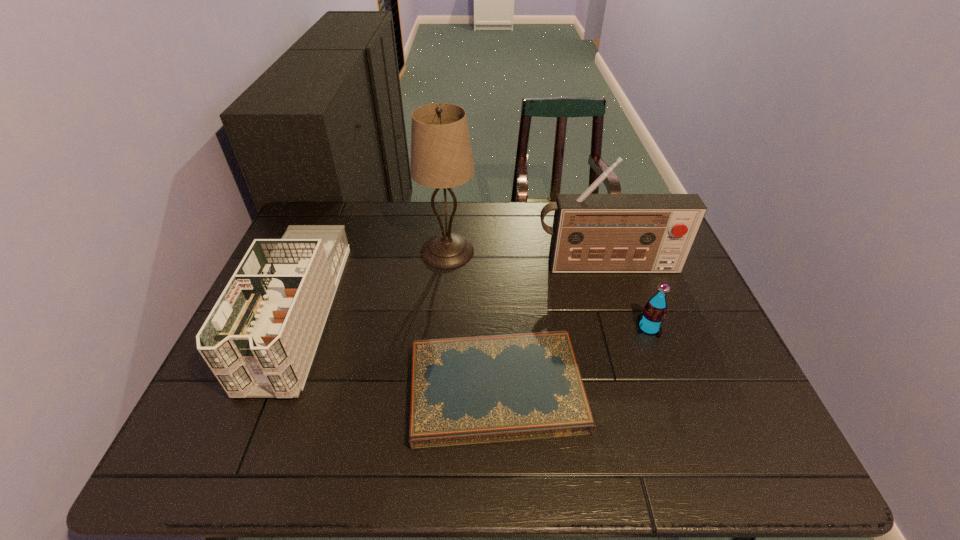
What are the coordinates of `the tallest object` in the screenshot? It's located at (441, 157).

In order to click on radio receiver in this screenshot , I will do `click(592, 233)`.

At what (x,y) coordinates should I click in order to perform the action: click on the third shortest object. Please return your answer as a coordinate pair (x, y). Looking at the image, I should click on (259, 340).

Identify the location of dollhouse. (259, 340).

Locate an element on the screen. soda is located at coordinates (650, 320).

The image size is (960, 540). What are the coordinates of `paperback book` in the screenshot? It's located at (475, 390).

The image size is (960, 540). In order to click on vacant space located on the front-facing side of the tallest object in this screenshot , I will do `click(544, 251)`.

I want to click on vacant space located on the front panel of the fourth shortest object, so click(638, 366).

Find the location of a particular element. This screenshot has height=540, width=960. free region located at the entrance of the third shortest object is located at coordinates (240, 455).

The width and height of the screenshot is (960, 540). What are the coordinates of `vacant space positioned on the front of the fourth tallest object` in the screenshot? It's located at (668, 383).